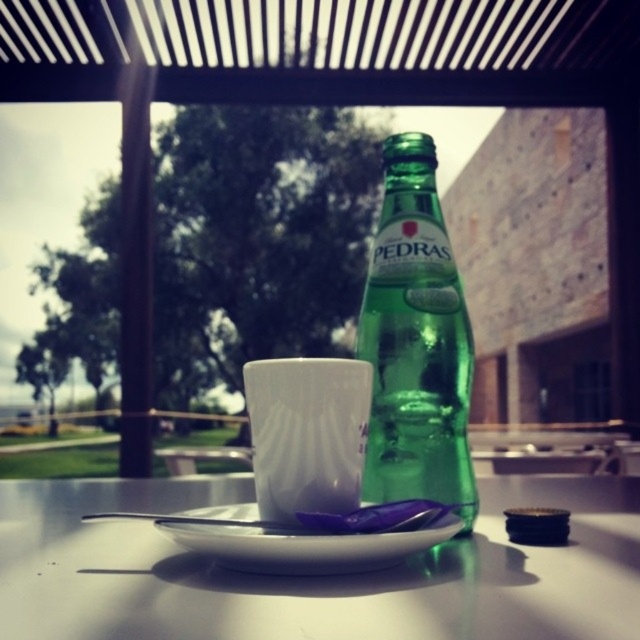
Consider the image. Which of these two, white glossy plate at center or white glossy mug at center, stands taller?

white glossy plate at center is taller.

Does white glossy plate at center have a lesser height compared to white glossy mug at center?

No, white glossy plate at center is not shorter than white glossy mug at center.

The height and width of the screenshot is (640, 640). What are the coordinates of `white glossy plate at center` in the screenshot? It's located at (312, 577).

This screenshot has height=640, width=640. Find the location of `white glossy plate at center`. white glossy plate at center is located at coordinates (312, 577).

Is green glass bottle at center further to the viewer compared to white glossy saucer at center?

Yes, green glass bottle at center is further from the viewer.

Does green glass bottle at center have a greater height compared to white glossy saucer at center?

Yes, green glass bottle at center is taller than white glossy saucer at center.

The image size is (640, 640). In order to click on green glass bottle at center in this screenshot , I will do `click(416, 342)`.

Image resolution: width=640 pixels, height=640 pixels. I want to click on green glass bottle at center, so click(416, 342).

Between point (304, 461) and point (339, 541), which one is positioned in front?

Point (339, 541)

Can you confirm if white glossy mug at center is wider than white glossy saucer at center?

No, white glossy mug at center is not wider than white glossy saucer at center.

Describe the element at coordinates (307, 433) in the screenshot. I see `white glossy mug at center` at that location.

What are the coordinates of `white glossy mug at center` in the screenshot? It's located at (307, 433).